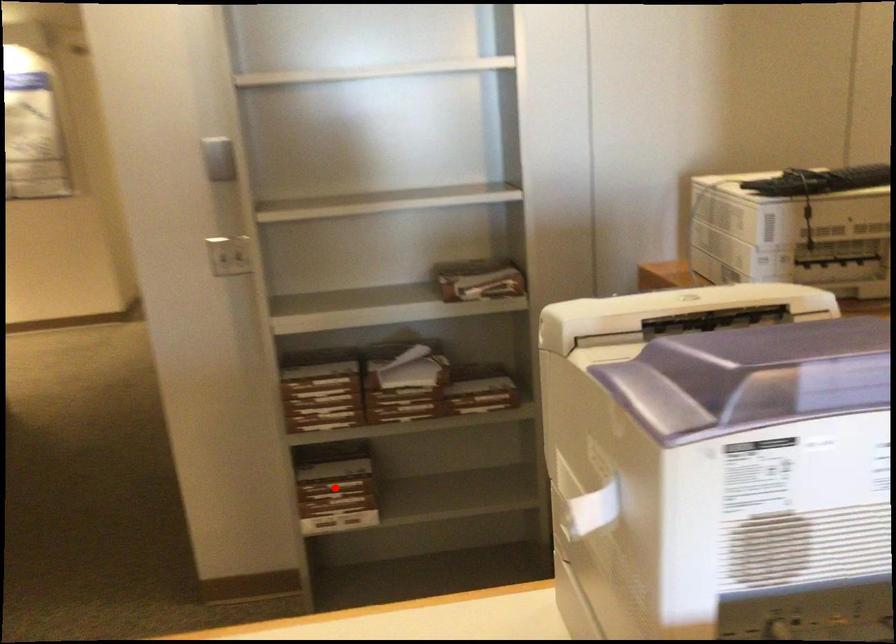
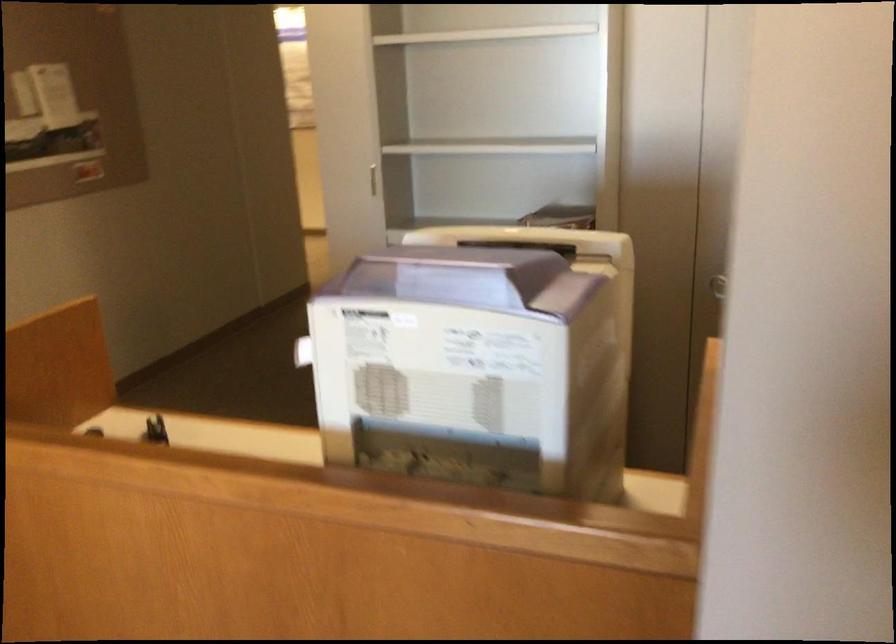
Question: I am providing you with two images of the same scene from different viewpoints. A red point is marked on the first image. Can you still see the location of the red point in image 2?

Choices:
 (A) Yes
 (B) No

Answer: (B)